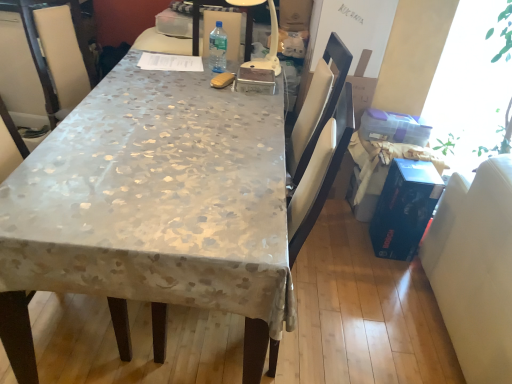
This screenshot has height=384, width=512. What do you see at coordinates (152, 211) in the screenshot?
I see `silky beige tablecloth at center` at bounding box center [152, 211].

The height and width of the screenshot is (384, 512). I want to click on blue cardboard box at right, so click(x=404, y=208).

Considering the positions of points (215, 52) and (249, 65), is point (215, 52) farther from camera compared to point (249, 65)?

Yes.

Is white plastic lamp at center at the back of clear plastic bottle at center?

No, clear plastic bottle at center's orientation is not away from white plastic lamp at center.

Is clear plastic bottle at center directly adjacent to white plastic lamp at center?

clear plastic bottle at center and white plastic lamp at center are clearly separated.

Considering the sizes of objects clear plastic bottle at center and white plastic lamp at center in the image provided, who is smaller, clear plastic bottle at center or white plastic lamp at center?

clear plastic bottle at center.

Is clear plastic bottle at center facing towards white leather swivel chair at right?

No, clear plastic bottle at center is not turned towards white leather swivel chair at right.

Is white leather swivel chair at right surrounded by clear plastic bottle at center?

No, white leather swivel chair at right is not inside clear plastic bottle at center.

From the image's perspective, between clear plastic bottle at center and white leather swivel chair at right, which one is located above?

clear plastic bottle at center.

From a real-world perspective, who is located lower, clear plastic bottle at center or white leather swivel chair at right?

From a 3D spatial view, white leather swivel chair at right is below.

Who is bigger, white leather swivel chair at right or white plastic lamp at center?

white leather swivel chair at right.

How far apart are white leather swivel chair at right and white plastic lamp at center?

4.05 feet.

Is white leather swivel chair at right positioned with its back to white plastic lamp at center?

Correct, white leather swivel chair at right is looking away from white plastic lamp at center.

You are a GUI agent. You are given a task and a screenshot of the screen. Output one action in this format:
    pyautogui.click(x=<x>, y=<y>)
    Task: Click on the swivel chair located below the white plastic lamp at center (from the image's perspective)
    
    Given the screenshot: What is the action you would take?
    pyautogui.click(x=475, y=268)

Is silky beige tablecloth at center with white plastic lamp at center?

No, silky beige tablecloth at center is not making contact with white plastic lamp at center.

Is silky beige tablecloth at center wider than white plastic lamp at center?

Yes, silky beige tablecloth at center is wider than white plastic lamp at center.

From a real-world perspective, which is physically below, silky beige tablecloth at center or white plastic lamp at center?

silky beige tablecloth at center, from a real-world perspective.

Which object is closer to the camera, silky beige tablecloth at center or white plastic lamp at center?

silky beige tablecloth at center is in front.

Could you tell me if clear plastic bottle at center is facing blue cardboard box at right?

No.

From a real-world perspective, between clear plastic bottle at center and blue cardboard box at right, who is vertically lower?

blue cardboard box at right is physically lower.

Which point is more distant from viewer, (221, 52) or (381, 252)?

The point (381, 252) is behind.

Considering the sizes of white plastic lamp at center and silky beige tablecloth at center in the image, is white plastic lamp at center taller or shorter than silky beige tablecloth at center?

Clearly, white plastic lamp at center is shorter compared to silky beige tablecloth at center.

Is white plastic lamp at center located outside silky beige tablecloth at center?

white plastic lamp at center is positioned outside silky beige tablecloth at center.

Between white plastic lamp at center and silky beige tablecloth at center, which one has larger width?

silky beige tablecloth at center.

From a real-world perspective, who is located higher, white plastic lamp at center or silky beige tablecloth at center?

white plastic lamp at center.

Could white leather swivel chair at right be considered to be inside blue cardboard box at right?

No, white leather swivel chair at right is not surrounded by blue cardboard box at right.

Is blue cardboard box at right touching white leather swivel chair at right?

Result: There is a gap between blue cardboard box at right and white leather swivel chair at right.

From the image's perspective, which one is positioned lower, blue cardboard box at right or white leather swivel chair at right?

white leather swivel chair at right is shown below in the image.

Which of these two, blue cardboard box at right or white leather swivel chair at right, stands shorter?

blue cardboard box at right is shorter.

At what (x,y) coordinates should I click in order to perform the action: click on lamp in front of the clear plastic bottle at center. Please return your answer as a coordinate pair (x, y). Looking at the image, I should click on (269, 49).

This screenshot has width=512, height=384. In order to click on swivel chair located underneath the clear plastic bottle at center (from a real-world perspective) in this screenshot , I will do `click(475, 268)`.

Which object lies further to the anchor point clear plastic bottle at center, white plastic lamp at center or silky beige tablecloth at center?

silky beige tablecloth at center.

Considering their positions, is silky beige tablecloth at center positioned further to blue cardboard box at right than white leather swivel chair at right?

silky beige tablecloth at center lies further to blue cardboard box at right than the other object.

Considering their positions, is white plastic lamp at center positioned further to clear plastic bottle at center than white leather swivel chair at right?

Among the two, white leather swivel chair at right is located further to clear plastic bottle at center.

Which object lies further to the anchor point white leather swivel chair at right, clear plastic bottle at center or white plastic lamp at center?

Among the two, clear plastic bottle at center is located further to white leather swivel chair at right.

Looking at the image, which one is located further to white plastic lamp at center, clear plastic bottle at center or silky beige tablecloth at center?

silky beige tablecloth at center is positioned further to the anchor white plastic lamp at center.

Looking at the image, which one is located closer to white plastic lamp at center, silky beige tablecloth at center or blue cardboard box at right?

silky beige tablecloth at center lies closer to white plastic lamp at center than the other object.

Looking at the image, which one is located further to white leather swivel chair at right, white plastic lamp at center or blue cardboard box at right?

white plastic lamp at center is positioned further to the anchor white leather swivel chair at right.

Which object lies nearer to the anchor point white leather swivel chair at right, clear plastic bottle at center or silky beige tablecloth at center?

Among the two, silky beige tablecloth at center is located nearer to white leather swivel chair at right.

What are the coordinates of `lamp located between clear plastic bottle at center and blue cardboard box at right in the left-right direction` in the screenshot? It's located at (269, 49).

The image size is (512, 384). Identify the location of box between clear plastic bottle at center and white leather swivel chair at right. (404, 208).

This screenshot has width=512, height=384. What are the coordinates of `lamp between silky beige tablecloth at center and white leather swivel chair at right` in the screenshot? It's located at (269, 49).

Locate an element on the screen. The image size is (512, 384). box situated between white plastic lamp at center and white leather swivel chair at right from left to right is located at coordinates (404, 208).